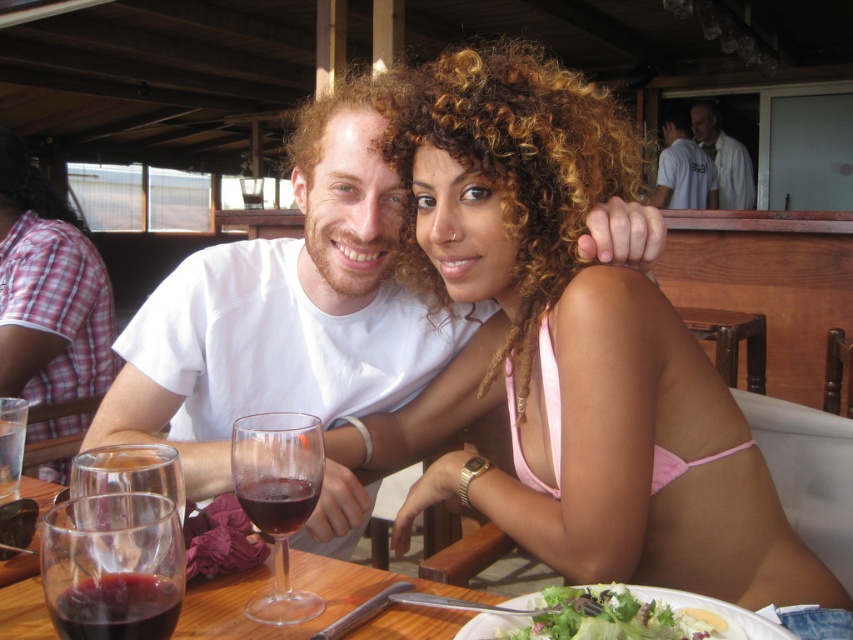
Question: Which point is farther from the camera taking this photo?

Choices:
 (A) (601, 605)
 (B) (62, 288)

Answer: (B)

Question: Which object appears closest to the camera in this image?

Choices:
 (A) white cotton shirt at center
 (B) green leafy salad at lower center
 (C) pink fabric bikini at center
 (D) transparent glass at table

Answer: (D)

Question: Considering the real-world distances, which object is farthest from the transparent glass at center?

Choices:
 (A) pink fabric bikini at center
 (B) transparent glass at table left
 (C) green leafy salad at lower center
 (D) pink fabric bikini top at center

Answer: (A)

Question: Considering the relative positions of transparent glass at center and transparent glass at table center in the image provided, where is transparent glass at center located with respect to transparent glass at table center?

Choices:
 (A) below
 (B) above

Answer: (A)

Question: Is transparent glass at table left wider than red glass wine at table center?

Choices:
 (A) yes
 (B) no

Answer: (A)

Question: In this image, where is pink fabric bikini at center located relative to pink fabric bikini top at center?

Choices:
 (A) below
 (B) above

Answer: (B)